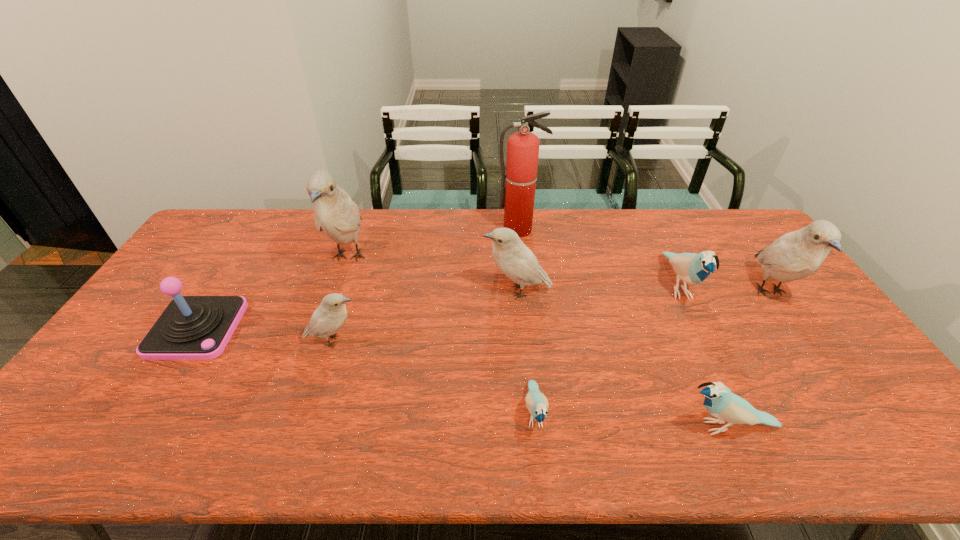
You are a GUI agent. You are given a task and a screenshot of the screen. Output one action in this format:
    pyautogui.click(x=<x>, y=<y>)
    Task: Click on the fifth farthest bird
    
    Given the screenshot: What is the action you would take?
    pyautogui.click(x=329, y=317)

Identify the location of the smallest white bird. coord(329,317).

Identify the location of the second biggest blue bird. This screenshot has height=540, width=960. (720, 402).

The height and width of the screenshot is (540, 960). Find the location of `the smallest blue bird`. the smallest blue bird is located at coordinates (537, 404).

At what (x,y) coordinates should I click in order to perform the action: click on the shortest object. Please return your answer as a coordinate pair (x, y). The image size is (960, 540). Looking at the image, I should click on (537, 404).

Find the location of a particular element. This screenshot has width=960, height=540. vacant space located with the nozzle and gauge on the fire extinguisher is located at coordinates (521, 251).

Locate an element on the screen. The image size is (960, 540). vacant space located 0.130m at the beak of the biggest white bird is located at coordinates (326, 321).

The image size is (960, 540). I want to click on vacant area situated at the beak of the second tallest bird, so click(821, 364).

The height and width of the screenshot is (540, 960). Find the location of `free region located at the beak of the second smallest white bird`. free region located at the beak of the second smallest white bird is located at coordinates tap(370, 292).

Find the location of `free space located 0.170m at the beak of the second smallest white bird`. free space located 0.170m at the beak of the second smallest white bird is located at coordinates (427, 292).